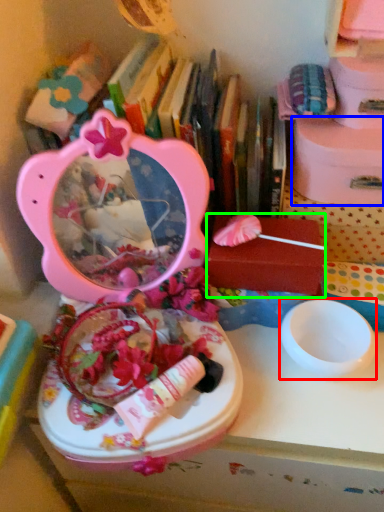
Question: Based on their relative distances, which object is farther from bowl (highlighted by a red box)? Choose from storage box (highlighted by a blue box) and storage box (highlighted by a green box).

Choices:
 (A) storage box
 (B) storage box

Answer: (A)